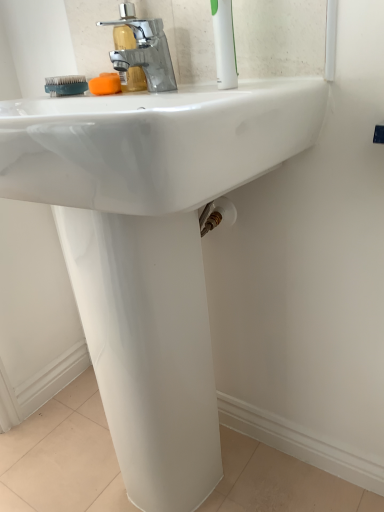
Find the location of a particular element. The height and width of the screenshot is (512, 384). free space in front of polished chrome faucet at upper center is located at coordinates (130, 100).